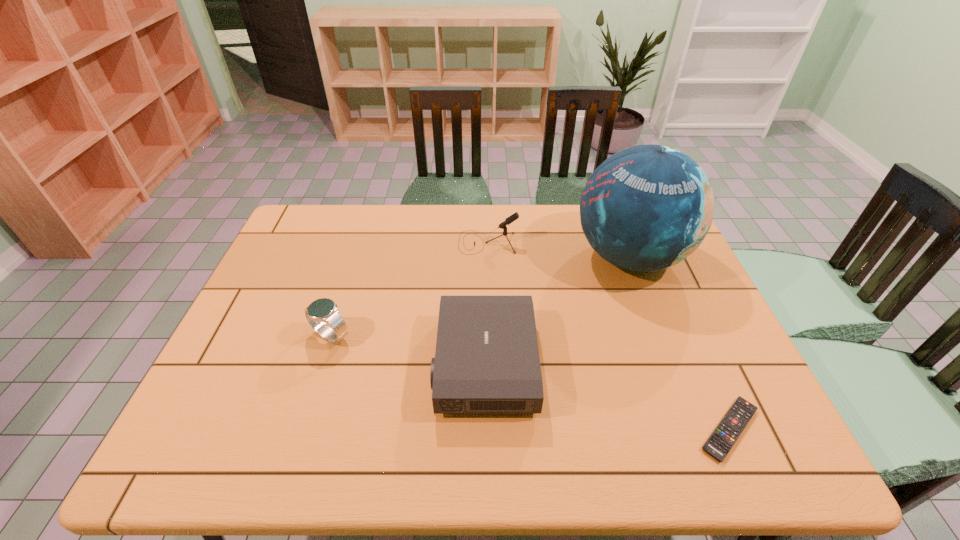
This screenshot has width=960, height=540. I want to click on free spot that satisfies the following two spatial constraints: 1. on the stand of the microphone; 2. on the back side of the remote control, so click(x=492, y=429).